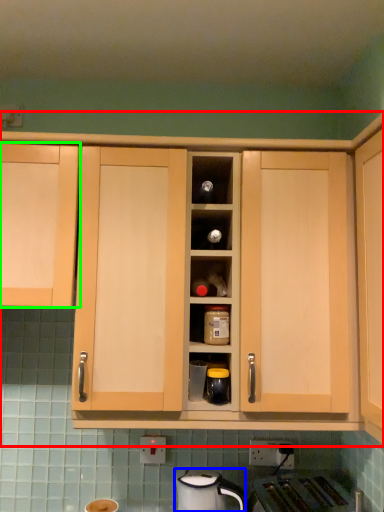
Question: Estimate the real-world distances between objects in this image. Which object is farther from cabinetry (highlighted by a red box), home appliance (highlighted by a blue box) or cabinetry (highlighted by a green box)?

Choices:
 (A) home appliance
 (B) cabinetry

Answer: (A)